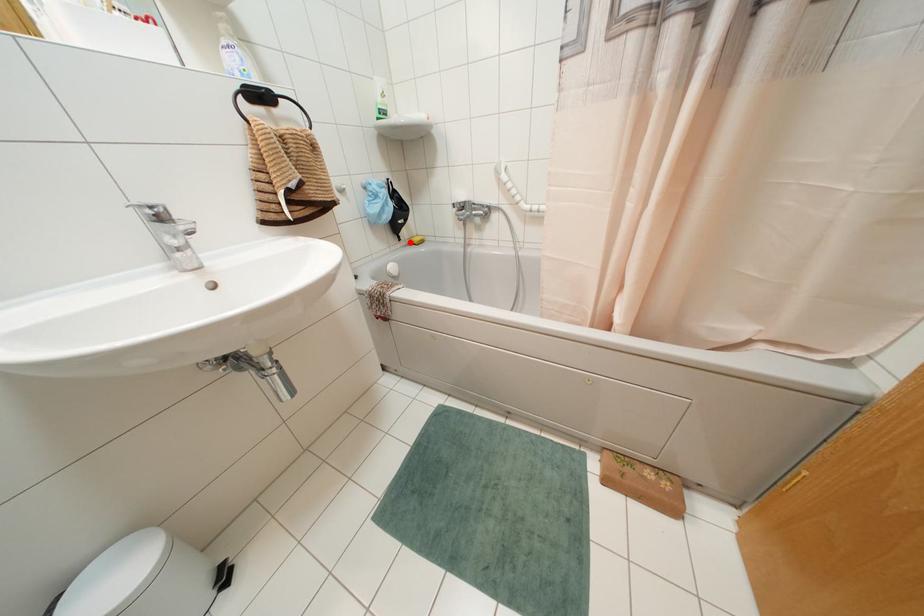
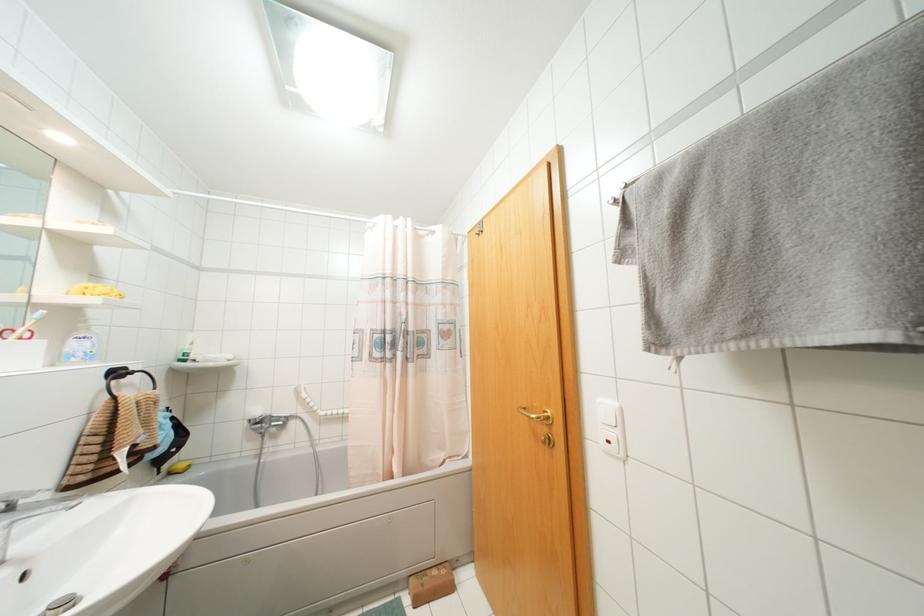
Where in the second image is the point corresponding to the highlighted location from the first image?

(169, 472)